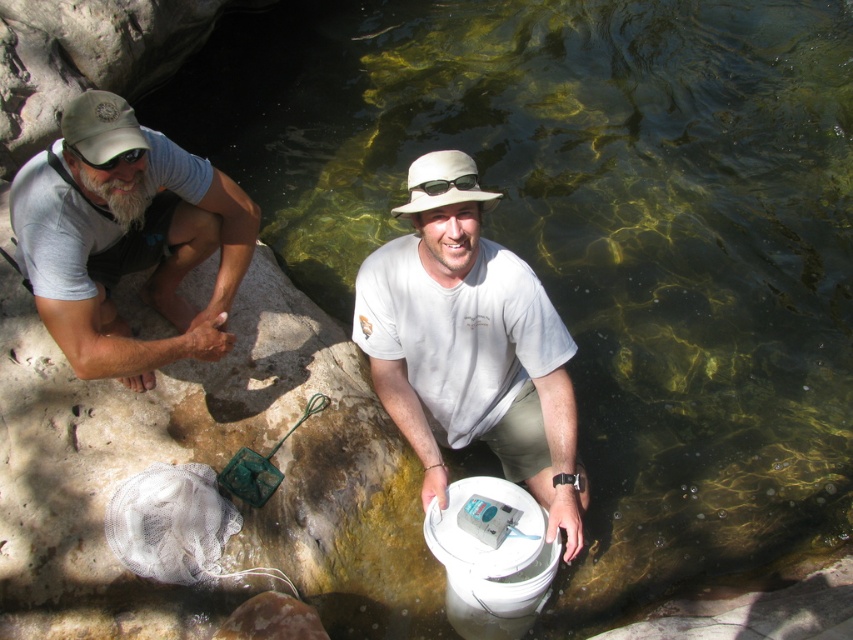
You are a photographer trying to capture a group photo of the white matte shirt at center and the matte gray shirt at left. Which shirt should you position to the left side in the frame to match their current arrangement?

The matte gray shirt at left should be positioned to the left side in the frame since the white matte shirt at center is currently on the right side of the matte gray shirt at left.

You are a photographer trying to capture a candid shot of the white matte shirt at center. Your camera is 7.57 feet away from the subject. According to the rule of thirds, should you move closer or farther away to frame the shot properly?

The camera is 7.57 feet away from the white matte shirt at center. To follow the rule of thirds, you should adjust your position so the subject aligns with the grid lines, but the distance itself doesn not violate the rule. The rule of thirds focuses on composition placement rather than distance.

What object is located at the coordinates point (469, 344)?

The point (469, 344) corresponds to the white matte shirt at center.